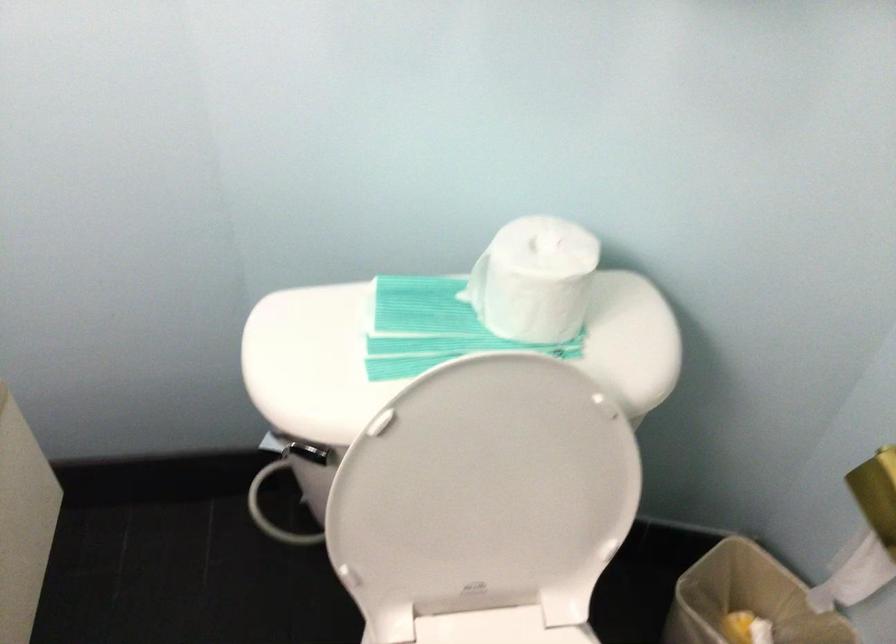
Describe the element at coordinates (486, 496) in the screenshot. This screenshot has width=896, height=644. I see `the white toilet lid` at that location.